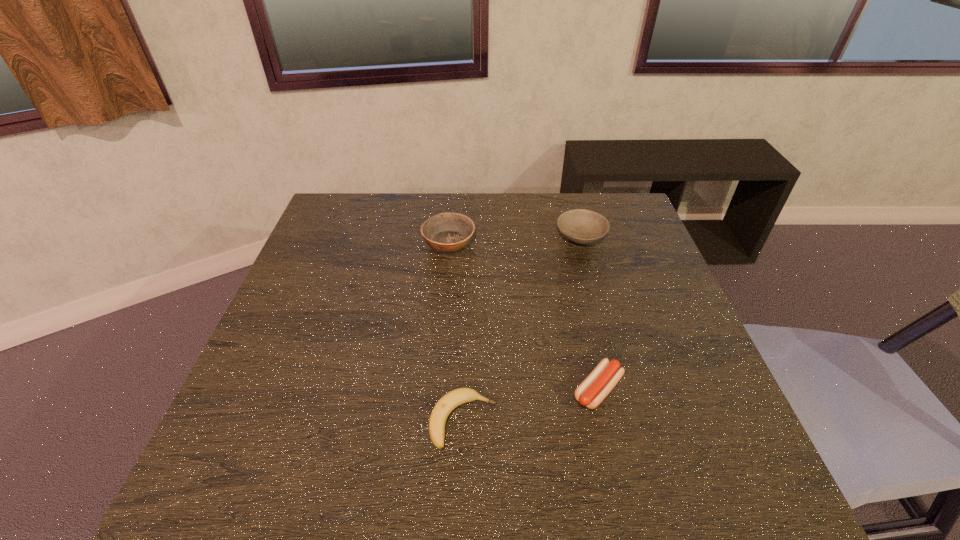
At what (x,y) coordinates should I click in order to perform the action: click on vacant point at the far edge. Please return your answer as a coordinate pair (x, y). The image size is (960, 540). Looking at the image, I should click on (488, 195).

Where is `free region at the near edge of the desktop`? The height and width of the screenshot is (540, 960). free region at the near edge of the desktop is located at coordinates (317, 498).

Where is `free space at the left edge of the desktop`? This screenshot has width=960, height=540. free space at the left edge of the desktop is located at coordinates (302, 423).

In the image, there is a desktop. Identify the location of vacant space at the right edge. The height and width of the screenshot is (540, 960). (608, 272).

What are the coordinates of `vacant position at the near left corner of the desktop` in the screenshot? It's located at click(284, 463).

The height and width of the screenshot is (540, 960). Identify the location of free space at the far right corner of the desktop. (603, 200).

Image resolution: width=960 pixels, height=540 pixels. I want to click on vacant space at the near right corner of the desktop, so click(x=727, y=495).

Where is `vacant area between the second shortest object and the shortest object`? The height and width of the screenshot is (540, 960). vacant area between the second shortest object and the shortest object is located at coordinates (531, 406).

In order to click on vacant area between the shortest object and the right bowl in this screenshot , I will do click(x=522, y=328).

The height and width of the screenshot is (540, 960). What are the coordinates of `vacant area between the left bowl and the banana` in the screenshot? It's located at (456, 332).